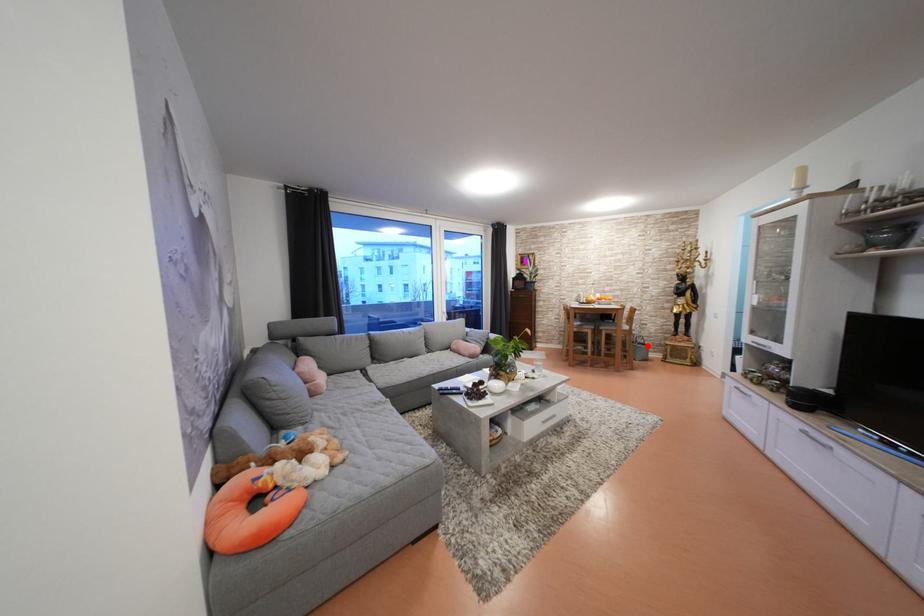
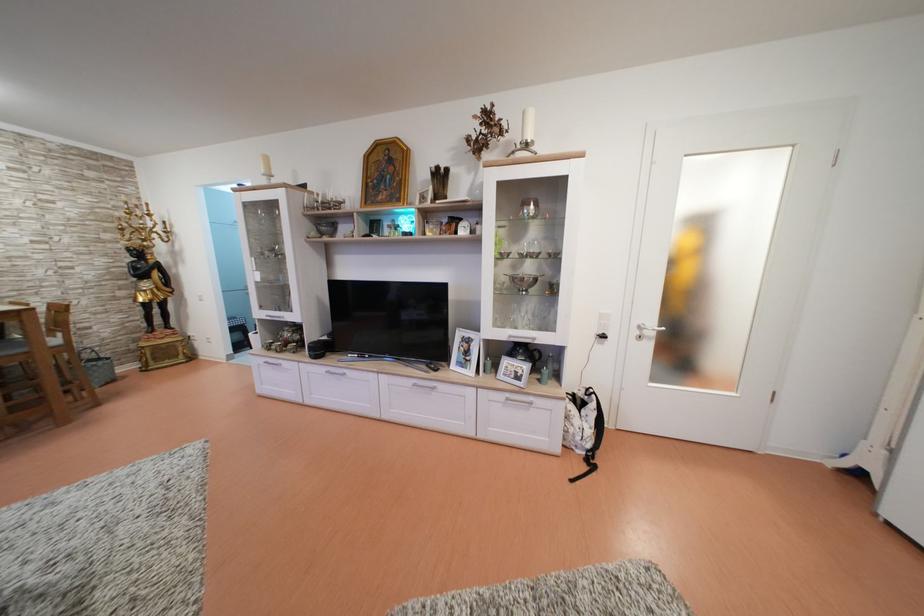
Locate, in the second image, the point that corresponds to the highlighted location in the first image.

(96, 361)